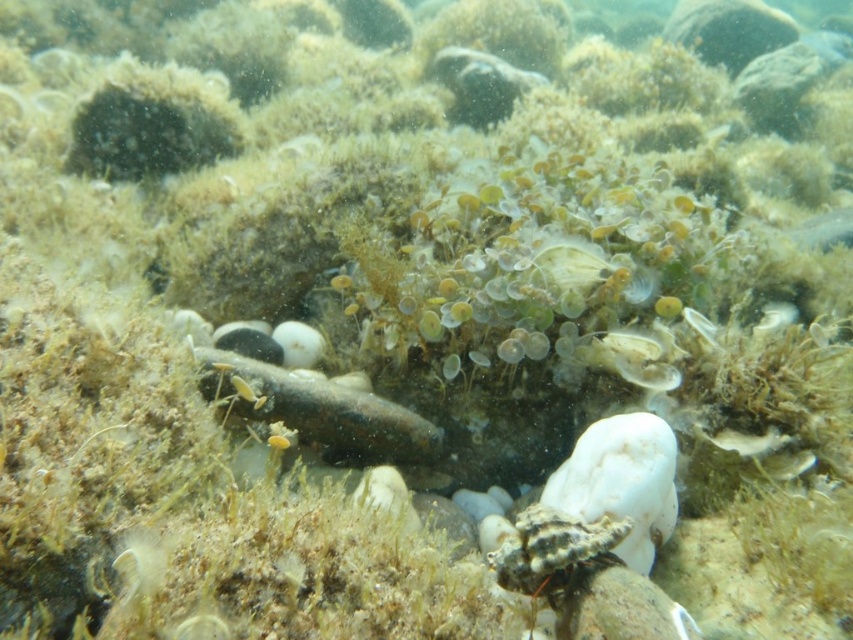
Can you confirm if speckled brown fish at center is positioned below translucent glass fish at lower right?

No, speckled brown fish at center is not below translucent glass fish at lower right.

Which is above, speckled brown fish at center or translucent glass fish at lower right?

speckled brown fish at center is higher up.

What do you see at coordinates (318, 410) in the screenshot? I see `speckled brown fish at center` at bounding box center [318, 410].

Where is `speckled brown fish at center`? speckled brown fish at center is located at coordinates (318, 410).

Does speckled brown shell at center have a greater height compared to translucent glass fish at lower right?

Correct, speckled brown shell at center is much taller as translucent glass fish at lower right.

Is point (592, 566) closer to camera compared to point (738, 444)?

That is True.

Image resolution: width=853 pixels, height=640 pixels. Find the location of `speckled brown shell at center`. speckled brown shell at center is located at coordinates (554, 552).

Who is more forward, (380, 408) or (546, 582)?

Point (546, 582) is more forward.

Does speckled brown fish at center appear over speckled brown shell at center?

Correct, speckled brown fish at center is located above speckled brown shell at center.

Describe the element at coordinates (318, 410) in the screenshot. I see `speckled brown fish at center` at that location.

Where is `speckled brown fish at center`? speckled brown fish at center is located at coordinates (318, 410).